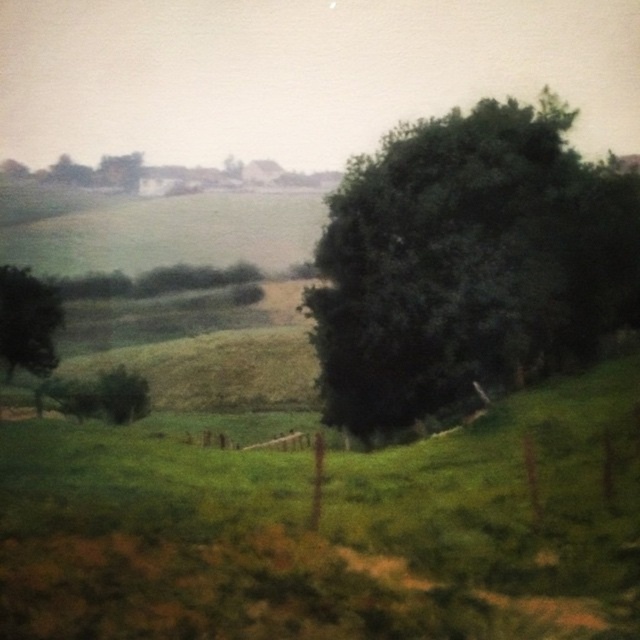
You are standing at the wooden fence in the foreground of the rural landscape. You see the green leafy tree at right and the green matte tree at left. Which tree appears higher in the image?

The green leafy tree at right appears higher in the image because it is located above the green matte tree at left.

You are standing at the edge of the grassy field in the scene, and you want to walk to the green leafy tree at right. The path is straight and clear. If your walking speed is 1.5 meters per second, how many seconds will it take you to reach the tree?

The distance between you and the green leafy tree at right is 27.87 meters. At a speed of 1.5 meters per second, dividing the distance by the speed gives 27.87 divided by 1.5, which equals approximately 18.58 seconds. Therefore, it will take roughly 18.6 seconds to reach the tree.

You are standing at the center of the grassy field in the foreground of this rural landscape. You notice a point marked at coordinates (467, 262) which corresponds to a green leafy tree at the right. If you want to walk directly towards that tree, should you head towards the right side of the scene or the left side?

The point marked at (467, 262) corresponds to the green leafy tree at the right. Since the tree is located at the right side of the scene, you should head towards the right side to walk directly towards it.